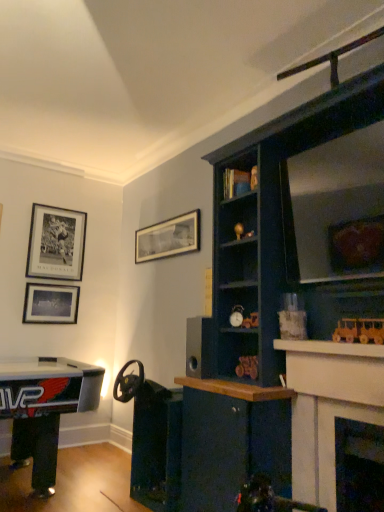
Question: Which direction should I rotate to face matte black alarm clock at center, which is counted as the first toy, starting from the left, — up or down?

Choices:
 (A) down
 (B) up

Answer: (A)

Question: Is matte black picture frame at upper left, marked as the third picture frame in a right-to-left arrangement, completely or partially outside of gold metallic ball at upper center, which is the fourth toy from bottom to top?

Choices:
 (A) yes
 (B) no

Answer: (A)

Question: From the image's perspective, would you say matte black picture frame at upper left, positioned as the 1th picture frame in left-to-right order, is shown under gold metallic ball at upper center, the 5th toy in the front-to-back sequence?

Choices:
 (A) yes
 (B) no

Answer: (A)

Question: Is matte black picture frame at upper left, marked as the third picture frame in a right-to-left arrangement, positioned far away from gold metallic ball at upper center, acting as the 2th toy starting from the left?

Choices:
 (A) no
 (B) yes

Answer: (B)

Question: Considering the relative sizes of matte black picture frame at upper left, marked as the third picture frame in a right-to-left arrangement, and gold metallic ball at upper center, which is the fourth toy in right-to-left order, in the image provided, is matte black picture frame at upper left, marked as the third picture frame in a right-to-left arrangement, smaller than gold metallic ball at upper center, which is the fourth toy in right-to-left order,?

Choices:
 (A) no
 (B) yes

Answer: (A)

Question: Is matte black picture frame at upper left, marked as the third picture frame in a right-to-left arrangement, to the right of gold metallic ball at upper center, acting as the 2th toy starting from the left, from the viewer's perspective?

Choices:
 (A) yes
 (B) no

Answer: (B)

Question: Considering the relative positions of matte black picture frame at upper left, marked as the third picture frame in a right-to-left arrangement, and gold metallic ball at upper center, acting as the 2th toy starting from the left, in the image provided, is matte black picture frame at upper left, marked as the third picture frame in a right-to-left arrangement, to the left of gold metallic ball at upper center, acting as the 2th toy starting from the left, from the viewer's perspective?

Choices:
 (A) yes
 (B) no

Answer: (A)

Question: Does matte black picture frame at upper left, which ranks as the 2th picture frame in left-to-right order, have a smaller size compared to metallic gold toy car at center-right, the first toy from the bottom?

Choices:
 (A) no
 (B) yes

Answer: (A)

Question: Is matte black picture frame at upper left, acting as the 2th picture frame starting from the right, not inside metallic gold toy car at center-right, the first toy from the bottom?

Choices:
 (A) no
 (B) yes

Answer: (B)

Question: Can you confirm if matte black picture frame at upper left, acting as the 2th picture frame starting from the right, is taller than metallic gold toy car at center-right, the first toy from the bottom?

Choices:
 (A) yes
 (B) no

Answer: (A)

Question: Is metallic gold toy car at center-right, the first toy from the bottom, a part of matte black picture frame at upper left, which ranks as the 2th picture frame in left-to-right order?

Choices:
 (A) no
 (B) yes

Answer: (A)

Question: From the image's perspective, is matte black picture frame at upper left, which ranks as the 2th picture frame in left-to-right order, located above metallic gold toy car at center-right, marked as the third toy in a left-to-right arrangement?

Choices:
 (A) yes
 (B) no

Answer: (A)

Question: Considering the relative sizes of matte black picture frame at upper left, which ranks as the 2th picture frame in left-to-right order, and metallic gold toy car at center-right, marked as the third toy in a left-to-right arrangement, in the image provided, is matte black picture frame at upper left, which ranks as the 2th picture frame in left-to-right order, bigger than metallic gold toy car at center-right, marked as the third toy in a left-to-right arrangement,?

Choices:
 (A) no
 (B) yes

Answer: (B)

Question: From a real-world perspective, is matte black alarm clock at center, the 4th toy positioned from the front, positioned under white glossy fireplace at upper right, acting as the 1th fireplace starting from the left, based on gravity?

Choices:
 (A) no
 (B) yes

Answer: (A)